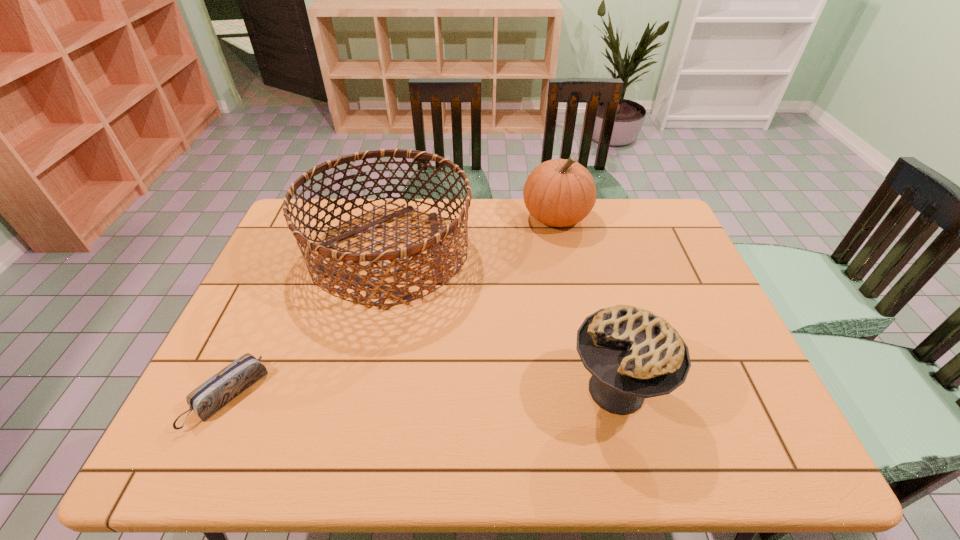
Locate an element on the screen. object that is the third nearest to the pie is located at coordinates (217, 391).

Choose which object is the second nearest neighbor to the pie. Please provide its 2D coordinates. Your answer should be formatted as a tuple, i.e. [(x, y)], where the tuple contains the x and y coordinates of a point satisfying the conditions above.

[(560, 192)]

At what (x,y) coordinates should I click in order to perform the action: click on vacant space that satisfies the following two spatial constraints: 1. on the back side of the basket; 2. on the left side of the shortest object. Please return your answer as a coordinate pair (x, y). The height and width of the screenshot is (540, 960). Looking at the image, I should click on (294, 254).

The image size is (960, 540). What are the coordinates of `free spot that satisfies the following two spatial constraints: 1. on the cut side of the pie; 2. on the front side of the pencil box` in the screenshot? It's located at (617, 396).